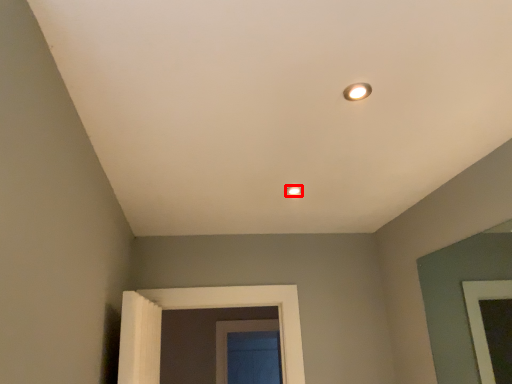
Question: From the image's perspective, where is lamp (annotated by the red box) located relative to light?

Choices:
 (A) above
 (B) below

Answer: (B)